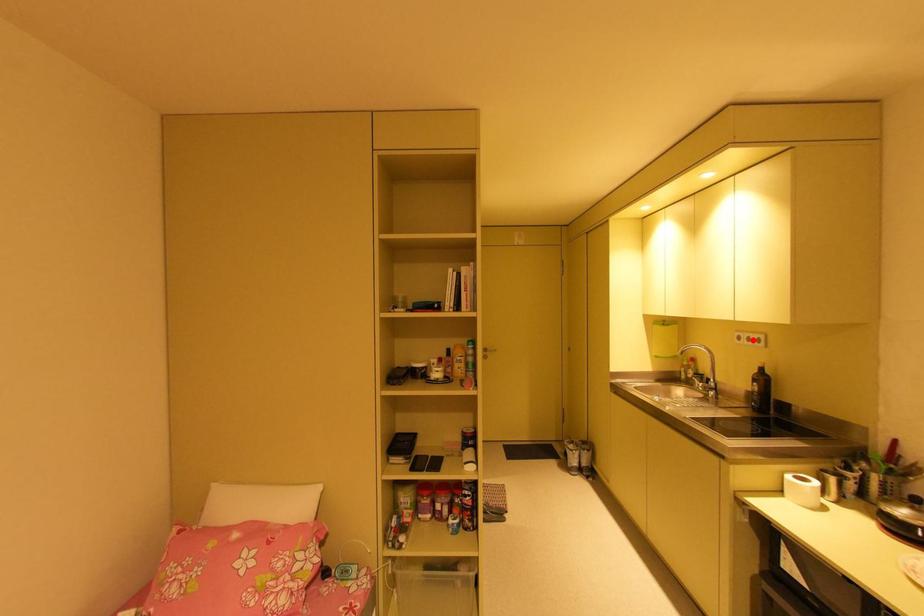
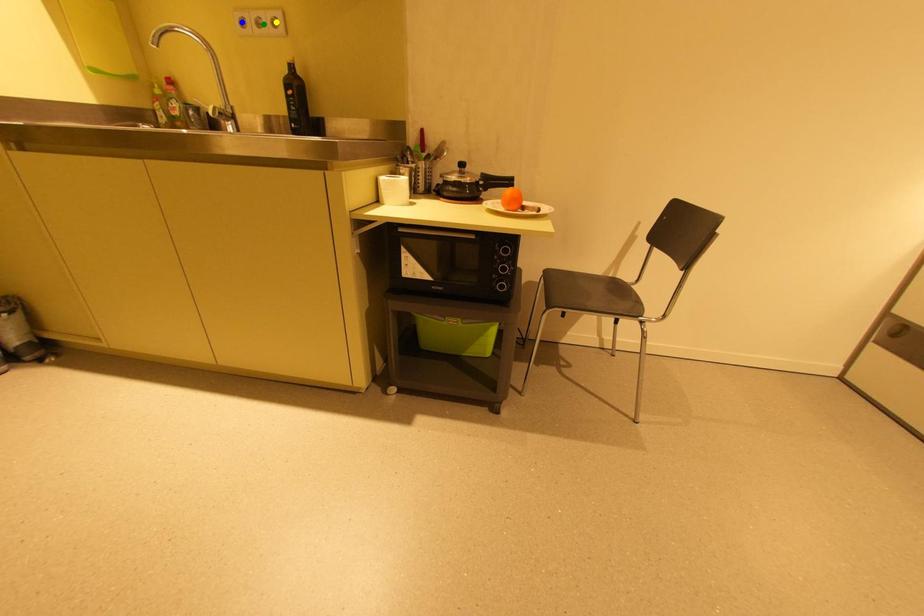
Question: I am providing you with two images of the same scene from different viewpoints. A red point is marked on the first image. You are given multiple points on the second image. Which spot in image 2 lines up with the point in image 1?

Choices:
 (A) blue point
 (B) yellow point
 (C) green point

Answer: (C)